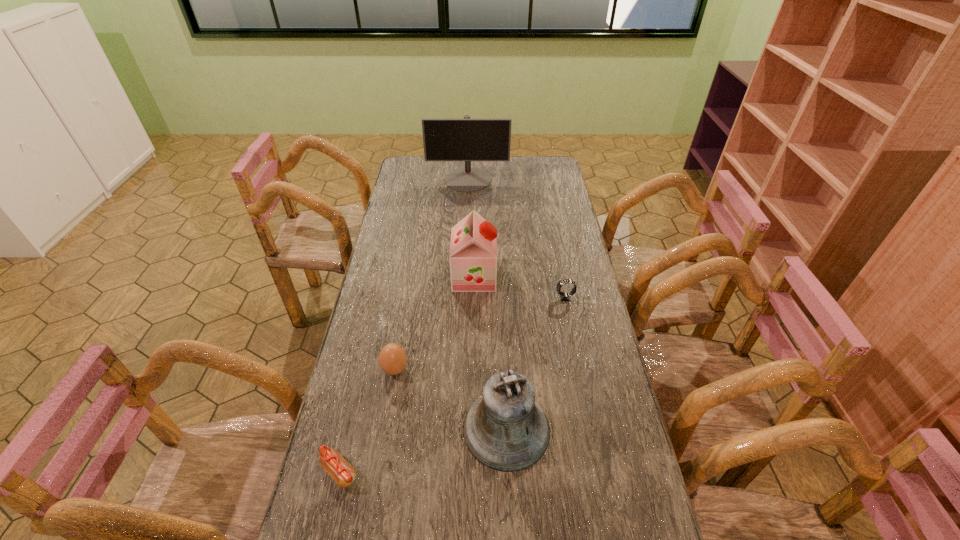
Locate an element on the screen. sausage present at the left edge is located at coordinates (335, 465).

Where is `object at the right edge`? The height and width of the screenshot is (540, 960). object at the right edge is located at coordinates (564, 296).

The height and width of the screenshot is (540, 960). In order to click on object present at the far left corner in this screenshot , I will do `click(466, 139)`.

The width and height of the screenshot is (960, 540). In the image, there is a desktop. In order to click on free space at the far edge in this screenshot , I will do `click(486, 169)`.

Identify the location of free space at the left edge of the desktop. (408, 185).

Locate an element on the screen. free location at the right edge of the desktop is located at coordinates (572, 229).

The width and height of the screenshot is (960, 540). Identify the location of free space at the far right corner of the desktop. pos(540,180).

Identify the location of free space between the leftmost object and the fifth nearest object. This screenshot has width=960, height=540. (407, 374).

The width and height of the screenshot is (960, 540). Identify the location of vacant space in between the shortest object and the fourth tallest object. pyautogui.click(x=367, y=421).

Identify the location of vacant area between the rightmost object and the computer monitor. The image size is (960, 540). (516, 239).